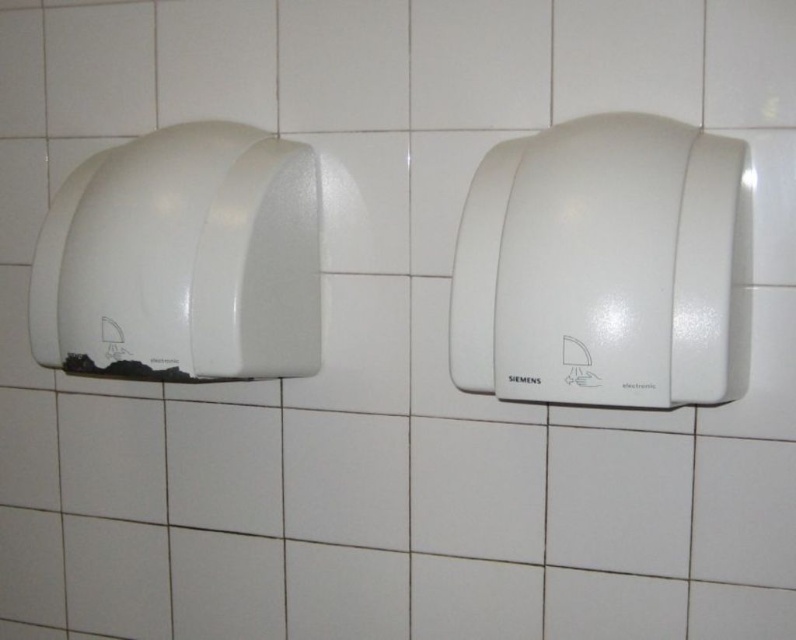
Question: Which point is closer to the camera?

Choices:
 (A) (545, 362)
 (B) (275, 161)

Answer: (A)

Question: Can you confirm if white plastic hand dryer at center is positioned above white matte hand dryer at left?

Choices:
 (A) no
 (B) yes

Answer: (A)

Question: Can you confirm if white plastic hand dryer at center is smaller than white matte hand dryer at left?

Choices:
 (A) yes
 (B) no

Answer: (A)

Question: Is white plastic hand dryer at center further to the viewer compared to white matte hand dryer at left?

Choices:
 (A) no
 (B) yes

Answer: (A)